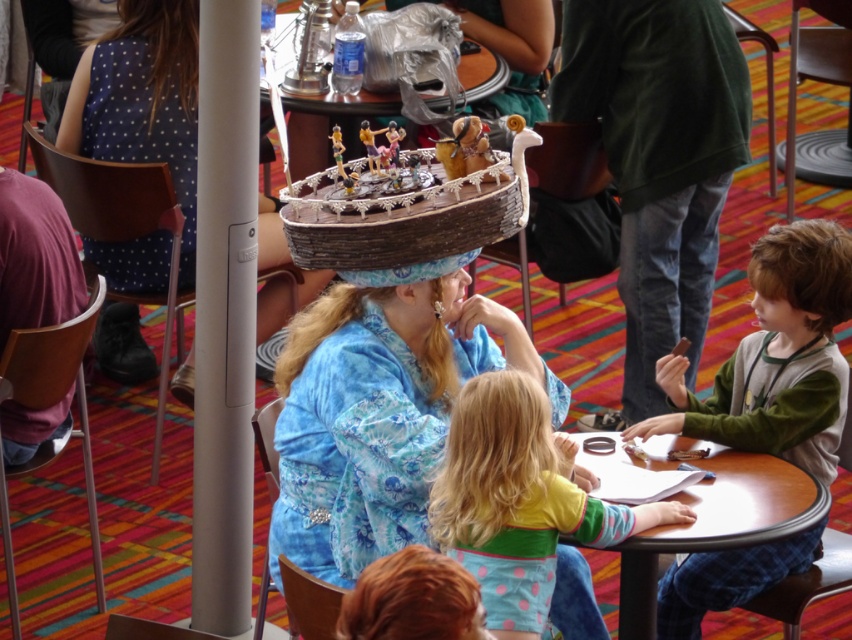
You are a photographer standing in the scene and want to capture both the green fleece shirt at lower right and the wooden boat at center in a single photo. Which object should you focus on first to ensure both are in frame?

The green fleece shirt at lower right has a greater height compared to the wooden boat at center, so you should focus on the taller green fleece shirt at lower right first to ensure both are in frame.